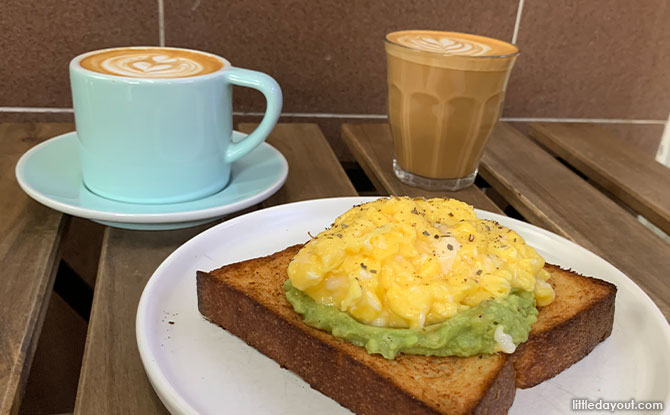
The image size is (670, 415). Find the location of `coffee cup`. coffee cup is located at coordinates (133, 137).